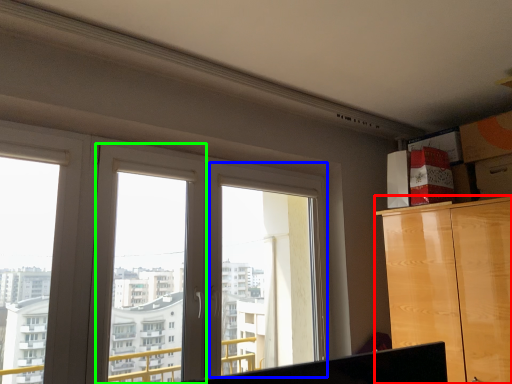
Question: Which object is the farthest from cabinetry (highlighted by a red box)? Choose among these: window frame (highlighted by a blue box) or window frame (highlighted by a green box).

Choices:
 (A) window frame
 (B) window frame

Answer: (B)